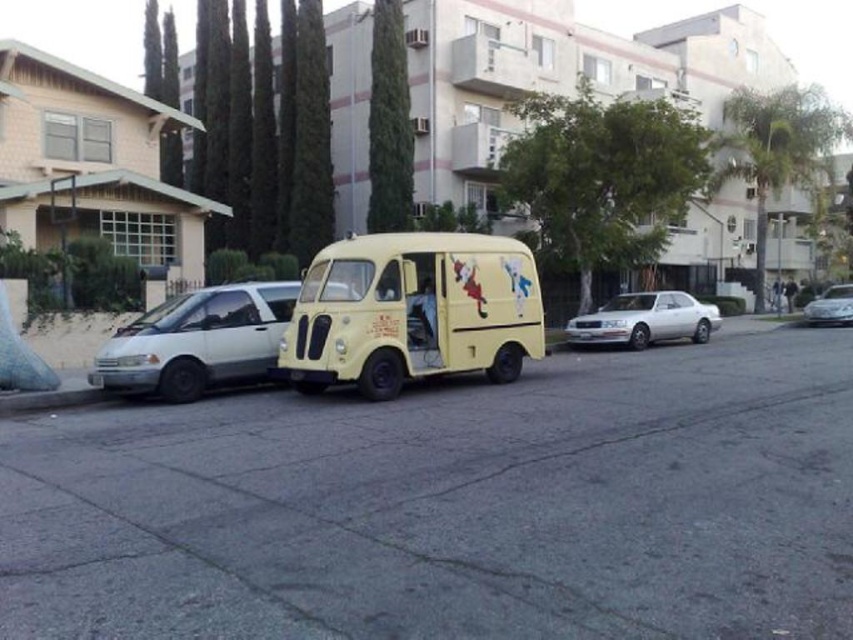
Question: Which point appears farthest from the camera in this image?

Choices:
 (A) (592, 333)
 (B) (384, 339)
 (C) (285, 289)
 (D) (822, 296)

Answer: (D)

Question: Estimate the real-world distances between objects in this image. Which object is farther from the metallic silver sedan at center?

Choices:
 (A) white matte van at center
 (B) yellow matte van at center
 (C) white metallic sedan at center-right

Answer: (A)

Question: Is yellow matte van at center behind white metallic sedan at center-right?

Choices:
 (A) yes
 (B) no

Answer: (B)

Question: Does white metallic sedan at center-right have a lesser width compared to metallic silver sedan at center?

Choices:
 (A) yes
 (B) no

Answer: (A)

Question: Which object appears farthest from the camera in this image?

Choices:
 (A) white matte van at center
 (B) yellow matte van at center

Answer: (A)

Question: Can you confirm if white matte van at center is wider than metallic silver sedan at center?

Choices:
 (A) no
 (B) yes

Answer: (A)